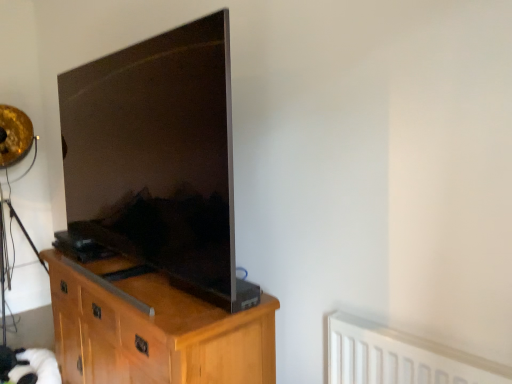
Question: Based on their positions, is white plastic radiator at lower right located to the left or right of light wood cabinet at center?

Choices:
 (A) right
 (B) left

Answer: (A)

Question: Is white plastic radiator at lower right taller or shorter than light wood cabinet at center?

Choices:
 (A) short
 (B) tall

Answer: (A)

Question: Which object is the farthest from the light wood cabinet at center?

Choices:
 (A) white plastic radiator at lower right
 (B) matte black tv at left

Answer: (A)

Question: Which object is the farthest from the light wood cabinet at center?

Choices:
 (A) white plastic radiator at lower right
 (B) matte black tv at left

Answer: (A)